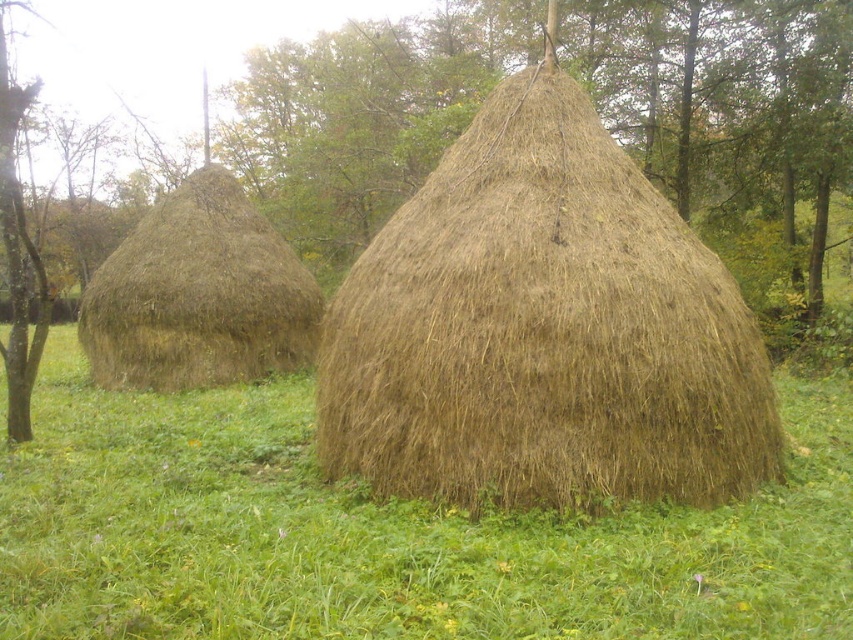
You are a farmer who needs to move a 1.2 meter wide tractor between the brown straw stack at center and the brown straw hut at left. Can you safely navigate the tractor through the space between them?

The distance between the brown straw stack at center and the brown straw hut at left is 7.97 meters. Since the tractor is only 1.2 meters wide, there is ample space for it to pass safely between them.

You are a farmer who needs to move both the brown straw bale at center and the brown straw stack at center to a storage barn. If you have a cart that can carry items up to 1.2 meters wide, which object should you move first to ensure it fits on the cart?

The brown straw bale at center might be wider than brown straw stack at center, so you should move the brown straw stack at center first to ensure it fits on the cart before attempting the potentially wider bale.

Consider the image. You are a gardener standing in the field between the two brown straw bales. You need to place a new flower pot between them. Which of the two, the brown straw bale at center or the brown straw stack at center, should you place the pot closer to if you want it to be in front of both?

You should place the pot closer to the brown straw bale at center because it is located below the brown straw stack at center, meaning it is closer to you. Since the bale is in front, placing the pot near it ensures it is in front of both structures.